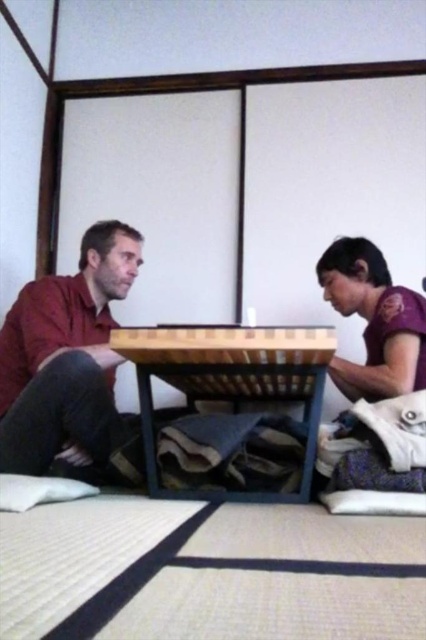
You are a guest in a traditional Japanese room and want to place a rectangular box that is 1 meter wide on the bamboo table at center. The purple matte shirt at lower right is currently occupying some space. Can the box fit on the table without moving the shirt?

The bamboo table at center is wider than the purple matte shirt at lower right. Since the table is wider, the box that is 1 meter wide can fit on the bamboo table at center even with the shirt present, as long as there is enough space around the shirt.

In the scene shown: You are standing in the room and want to place a small tray on the bamboo table at center. Given that the tray has a diameter of 30 cm, can you estimate whether it will fit on the table?

The bamboo table at center has a surface area that accommodates the tray of 30 cm diameter, so it should fit.

You are standing in the traditional Japanese room and want to place a small object on the floor between the matte red shirt at left and the purple top at right. Based on their positions, where should you place it to ensure it is equidistant from both?

The matte red shirt at left is located at point (65, 356). To place the object equidistant between both, calculate the midpoint between their coordinates.